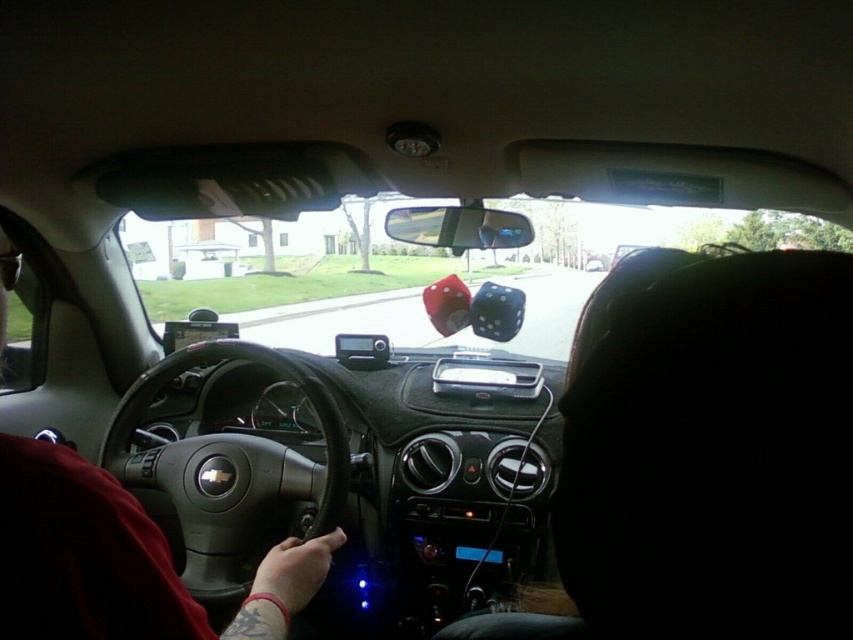
You are sitting in the passenger seat of a car and notice the black fabric headrest at upper right and the matte black steering wheel at center. Which object has a smaller width?

The black fabric headrest at upper right is thinner than the matte black steering wheel at center, so the black fabric headrest at upper right has a smaller width.

Based on the photo, you are a passenger in the car and want to place a small book on the object that is taller between the black fabric headrest at upper right and the dark red leather jacket at lower left. Which object should you choose?

The dark red leather jacket at lower left is taller than the black fabric headrest at upper right, so you should place the small book on the dark red leather jacket at lower left.